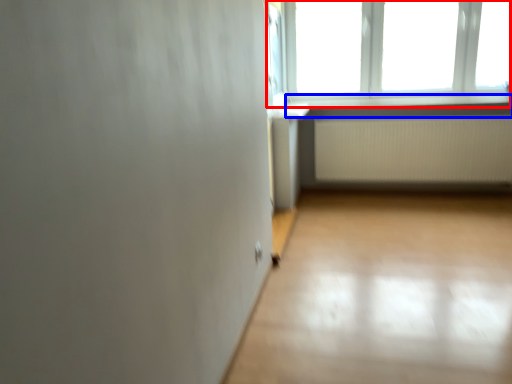
Question: Which object is closer to the camera taking this photo, window (highlighted by a red box) or window sill (highlighted by a blue box)?

Choices:
 (A) window
 (B) window sill

Answer: (A)